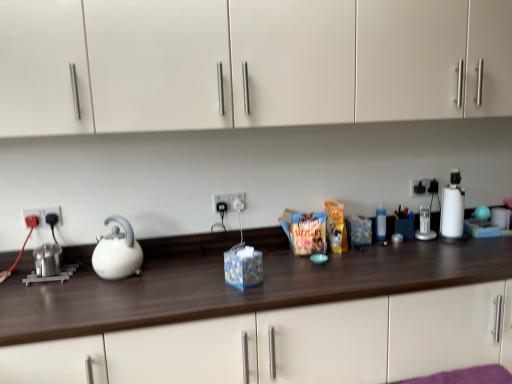
Question: Considering their positions, is white glossy kettle at left located in front of or behind white plastic coffee machine at right?

Choices:
 (A) behind
 (B) front

Answer: (B)

Question: In terms of width, does white glossy kettle at left look wider or thinner when compared to white plastic coffee machine at right?

Choices:
 (A) wide
 (B) thin

Answer: (A)

Question: Which object is positioned closest to the white matte cabinet at upper center?

Choices:
 (A) white plastic electric outlet at center, which is counted as the 2th electric outlet, starting from the right
 (B) black plastic electrical outlet at left, which ranks as the 1th electric outlet in left-to-right order
 (C) white glossy kettle at left
 (D) white plastic blender at right
 (E) transparent plastic bottle at right

Answer: (A)

Question: Considering the real-world distances, which object is closest to the black plastic electrical outlet at left, which ranks as the 1th electric outlet in left-to-right order?

Choices:
 (A) white glossy kettle at left
 (B) white plastic coffee machine at right
 (C) transparent plastic bottle at right
 (D) white plastic electric outlet at center, which is counted as the 2th electric outlet, starting from the right
 (E) black plastic electric outlet at upper right, which ranks as the 1th electric outlet in right-to-left order

Answer: (A)